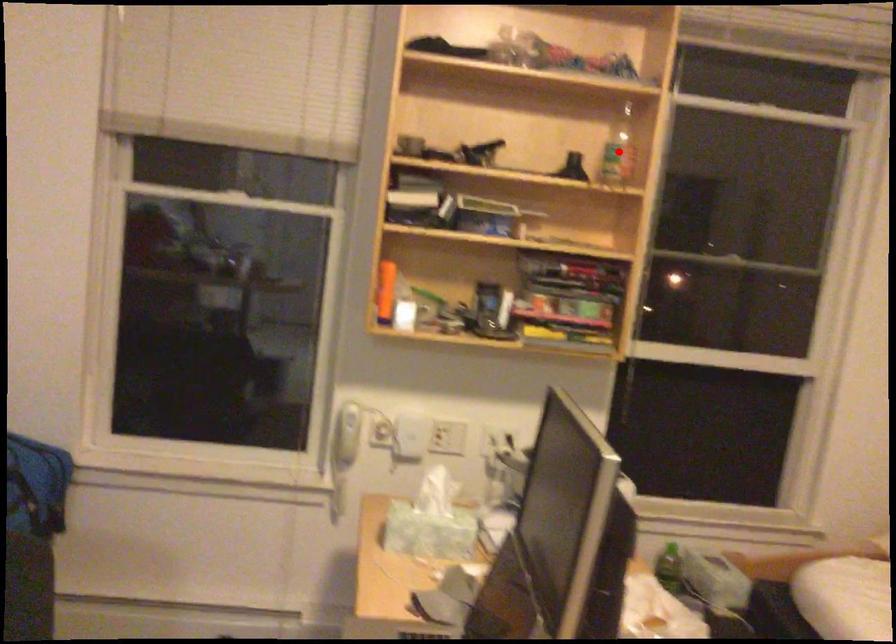
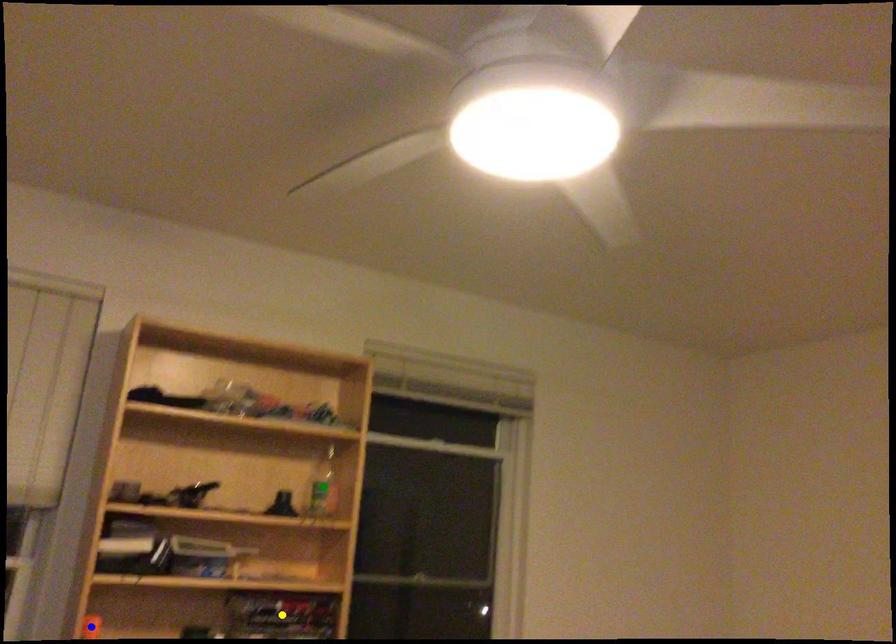
Question: I am providing you with two images of the same scene from different viewpoints. A red point is marked on the first image. You are given multiple points on the second image. Which point in image 2 represents the same 3d spot as the red point in image 1?

Choices:
 (A) green point
 (B) yellow point
 (C) blue point

Answer: (A)